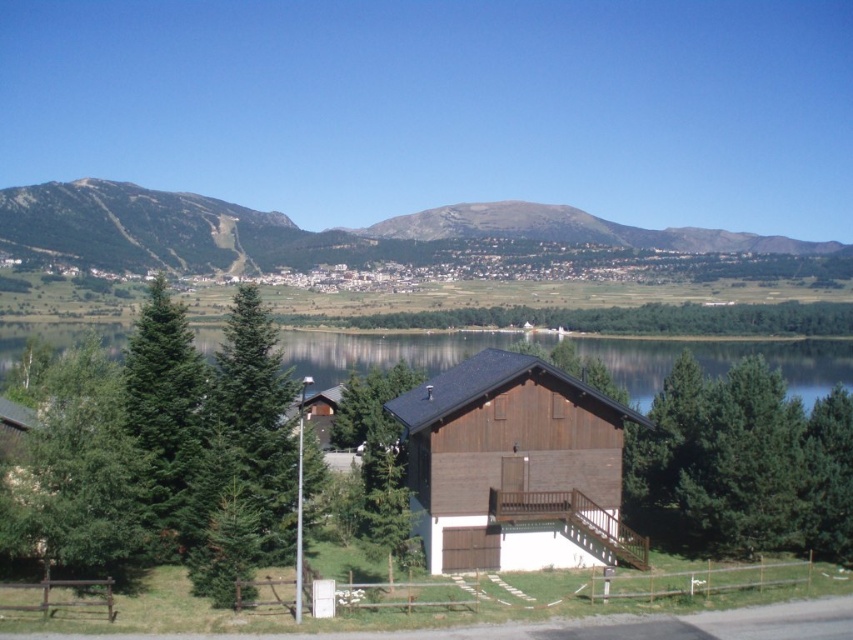
Question: Is rugged brown mountain at upper left bigger than transparent water at center?

Choices:
 (A) no
 (B) yes

Answer: (B)

Question: Among these points, which one is farthest from the camera?

Choices:
 (A) (24, 326)
 (B) (204, 234)

Answer: (B)

Question: Which point is farther from the camera taking this photo?

Choices:
 (A) (762, 243)
 (B) (544, 513)
 (C) (817, 468)
 (D) (340, 380)

Answer: (A)

Question: Which of the following is the closest to the observer?

Choices:
 (A) green textured pine tree at center
 (B) brown wooden cabin at center
 (C) rugged brown mountain at upper left

Answer: (B)

Question: From the image, what is the correct spatial relationship of brown wooden cabin at center in relation to transparent water at center?

Choices:
 (A) below
 (B) above

Answer: (A)

Question: Does brown wooden cabin at center appear on the left side of transparent water at center?

Choices:
 (A) yes
 (B) no

Answer: (B)